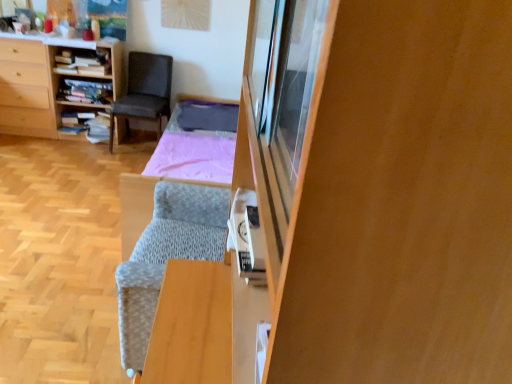
Where is `free point in front of wooden bookshelf at left`? free point in front of wooden bookshelf at left is located at coordinates (52, 155).